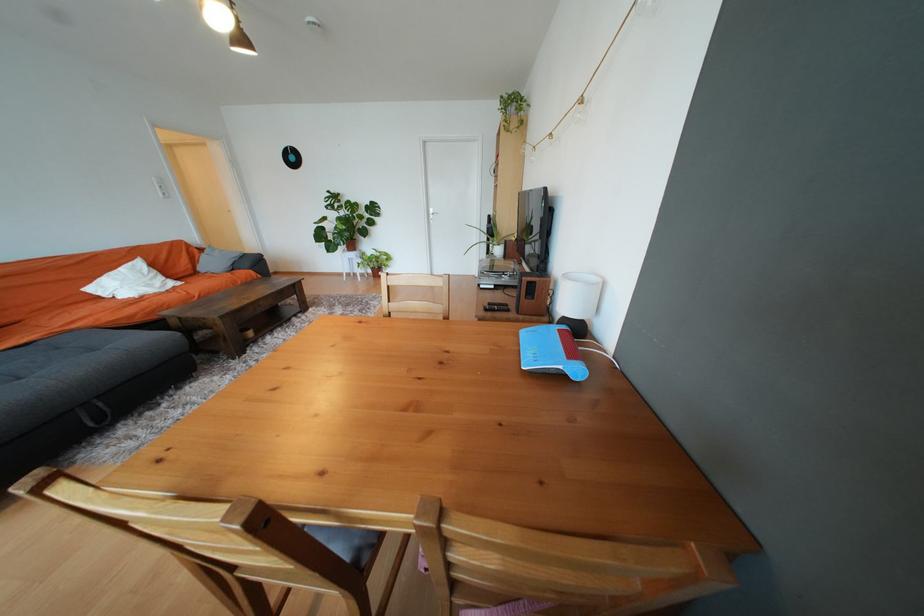
The location [577,301] corresponds to which object?

It refers to a white table lamp.